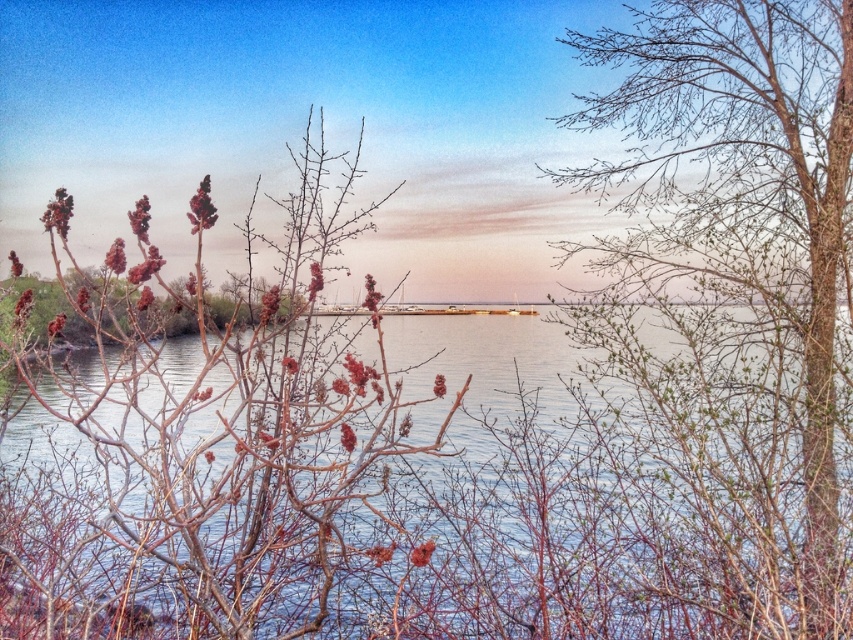
Is clear water at center in front of bare branches at left?

That is False.

The width and height of the screenshot is (853, 640). Find the location of `clear water at center`. clear water at center is located at coordinates (469, 518).

Between point (695, 440) and point (683, 216), which one is positioned in front?

Point (695, 440) is more forward.

Does point (524, 572) come behind point (785, 19)?

No, (524, 572) is closer to viewer.

The image size is (853, 640). What are the coordinates of `clear water at center` in the screenshot? It's located at (469, 518).

In the scene shown: Does bare branches at left have a larger size compared to bare branches at center?

Actually, bare branches at left might be smaller than bare branches at center.

Which is in front, point (436, 385) or point (662, 76)?

Point (436, 385) is in front.

At what (x,y) coordinates should I click in order to perform the action: click on bare branches at left. Please return your answer as a coordinate pair (x, y). The image size is (853, 640). Looking at the image, I should click on (207, 440).